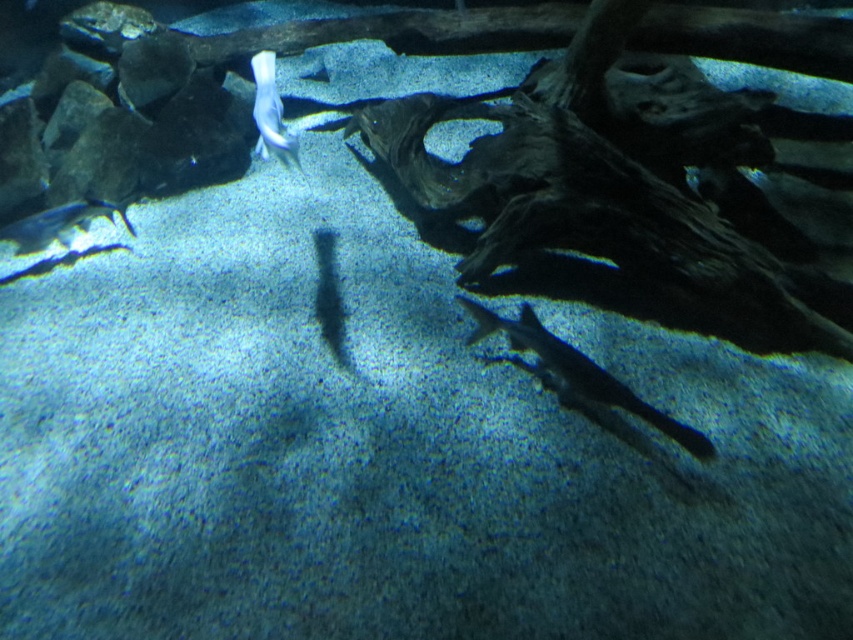
Question: Does translucent gray shark at lower right lie behind shiny blue fish at left?

Choices:
 (A) no
 (B) yes

Answer: (A)

Question: Is translucent gray shark at lower right positioned behind shiny blue fish at left?

Choices:
 (A) yes
 (B) no

Answer: (B)

Question: Estimate the real-world distances between objects in this image. Which object is closer to the shiny blue fish at left?

Choices:
 (A) white glossy fish at upper center
 (B) translucent gray shark at lower right

Answer: (A)

Question: Considering the relative positions of shiny blue fish at left and white glossy fish at upper center in the image provided, where is shiny blue fish at left located with respect to white glossy fish at upper center?

Choices:
 (A) below
 (B) above

Answer: (A)

Question: Which object is closer to the camera taking this photo?

Choices:
 (A) shiny blue fish at left
 (B) translucent gray shark at lower right

Answer: (B)

Question: Based on their relative distances, which object is nearer to the white glossy fish at upper center?

Choices:
 (A) translucent gray shark at lower right
 (B) shiny blue fish at left

Answer: (A)